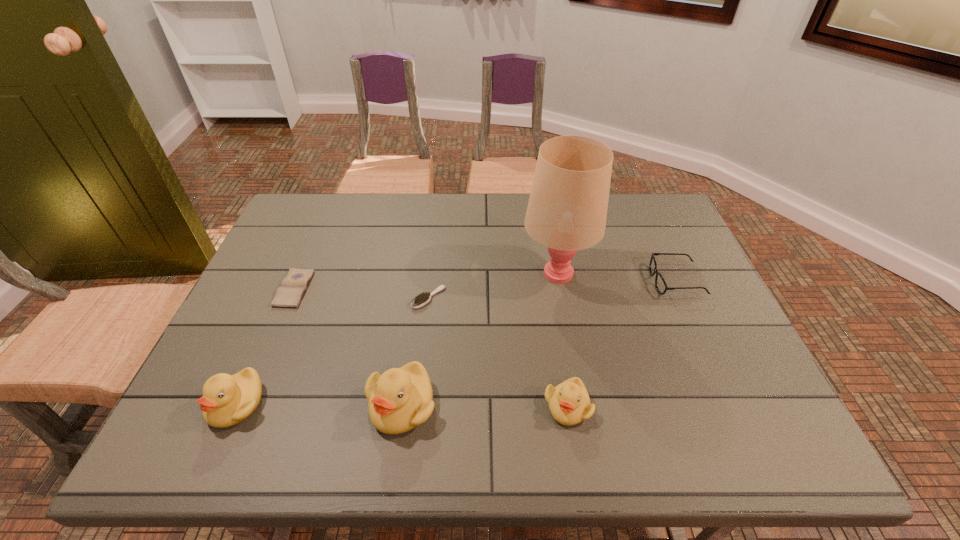
Where is `vacant space that satisfies the following two spatial constraints: 1. on the front-facing side of the spectacles; 2. on the beak of the tallest duckling`? The height and width of the screenshot is (540, 960). vacant space that satisfies the following two spatial constraints: 1. on the front-facing side of the spectacles; 2. on the beak of the tallest duckling is located at coordinates (732, 405).

Find the location of a particular element. The image size is (960, 540). blank area in the image that satisfies the following two spatial constraints: 1. on the front-facing side of the spectacles; 2. on the beak of the shortest duckling is located at coordinates (732, 407).

This screenshot has width=960, height=540. I want to click on vacant space that satisfies the following two spatial constraints: 1. on the front-facing side of the spectacles; 2. on the front side of the shortest object, so click(680, 289).

Find the location of a particular element. vacant space that satisfies the following two spatial constraints: 1. on the front-facing side of the rightmost object; 2. on the beak of the second tallest duckling is located at coordinates (732, 404).